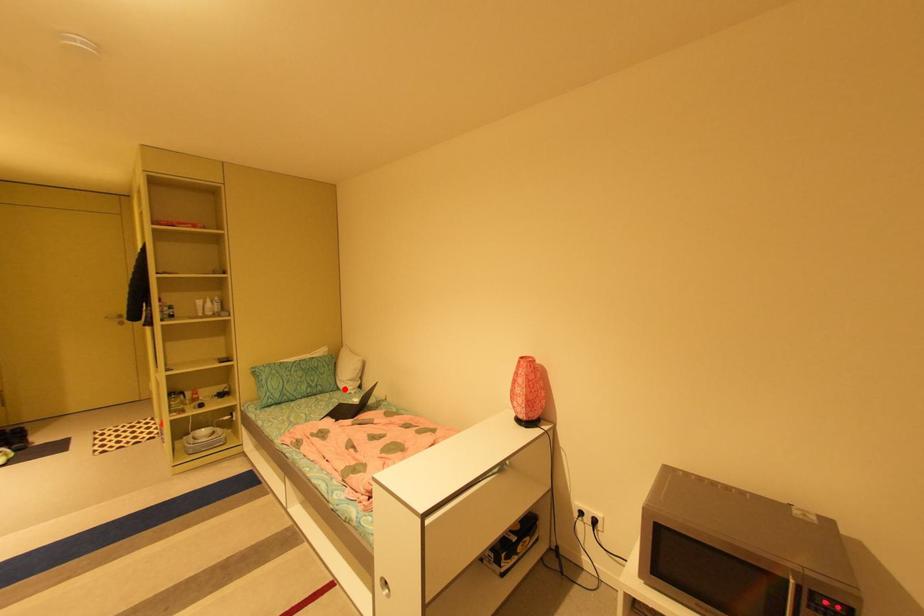
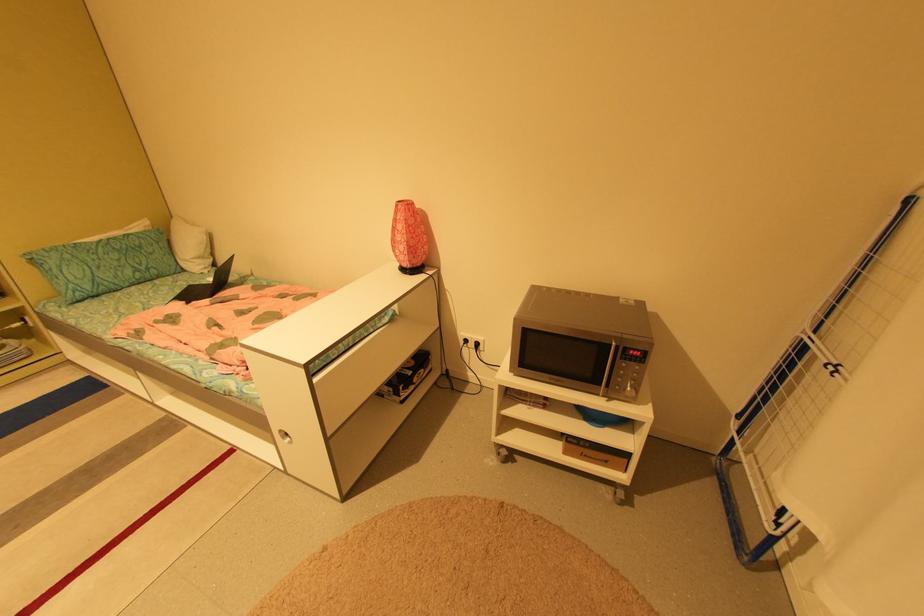
Question: I am providing you with two images of the same scene from different viewpoints. Image1 has a red point marked. In image2, the corresponding 3D location appears at what relative position? Reply with the corresponding letter.

Choices:
 (A) Closer
 (B) Farther

Answer: (A)